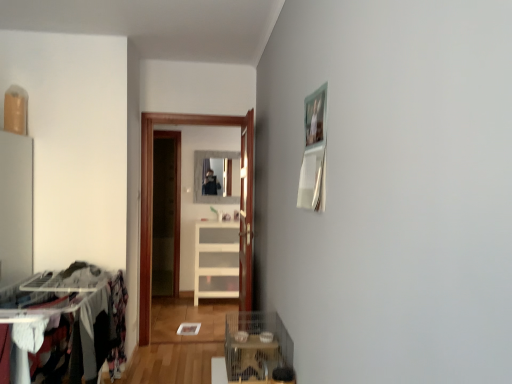
Question: From the image's perspective, is transparent glass door at center above or below wooden door at center?

Choices:
 (A) below
 (B) above

Answer: (A)

Question: Visually, is transparent glass door at center positioned to the left or to the right of wooden door at center?

Choices:
 (A) left
 (B) right

Answer: (A)

Question: Which object is the closest to the white marble mirror at center?

Choices:
 (A) transparent glass door at center
 (B) wooden door at center
 (C) metallic wire cage at lower center
 (D) white glossy cabinet at center

Answer: (D)

Question: Which object is the farthest from the wooden door at center?

Choices:
 (A) white marble mirror at center
 (B) metallic wire cage at lower center
 (C) white glossy cabinet at center
 (D) transparent glass door at center

Answer: (C)